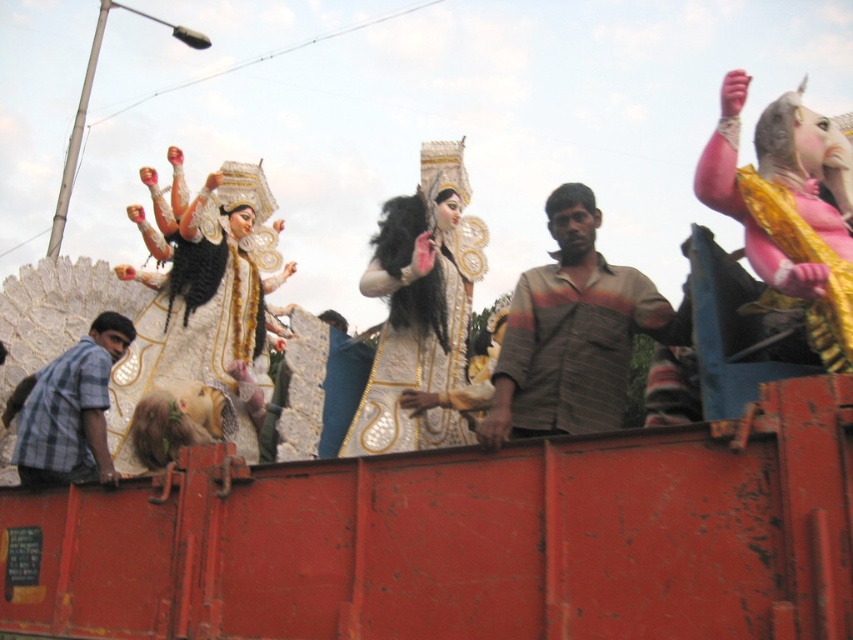
Does gold metallic statue at upper center have a larger size compared to gold textured fabric at left?

Yes, gold metallic statue at upper center is bigger than gold textured fabric at left.

Is gold metallic statue at upper center to the left of gold textured fabric at left from the viewer's perspective?

In fact, gold metallic statue at upper center is to the right of gold textured fabric at left.

Does point (630, 276) come farther from viewer compared to point (152, 394)?

No, (630, 276) is in front of (152, 394).

The image size is (853, 640). What are the coordinates of `gold metallic statue at upper center` in the screenshot? It's located at (621, 292).

Is gold metallic statue at upper center smaller than striped cotton shirt at center?

No, gold metallic statue at upper center is not smaller than striped cotton shirt at center.

Who is positioned more to the right, gold metallic statue at upper center or striped cotton shirt at center?

From the viewer's perspective, striped cotton shirt at center appears more on the right side.

What do you see at coordinates (621, 292) in the screenshot? I see `gold metallic statue at upper center` at bounding box center [621, 292].

The height and width of the screenshot is (640, 853). I want to click on gold metallic statue at upper center, so click(621, 292).

Based on the photo, which is above, gold metallic statue at upper center or checkered fabric shirt at left?

gold metallic statue at upper center

Does point (759, 141) come closer to viewer compared to point (24, 384)?

That is True.

Is point (763, 192) behind point (41, 435)?

No, (763, 192) is closer to viewer.

Locate an element on the screen. gold metallic statue at upper center is located at coordinates (621, 292).